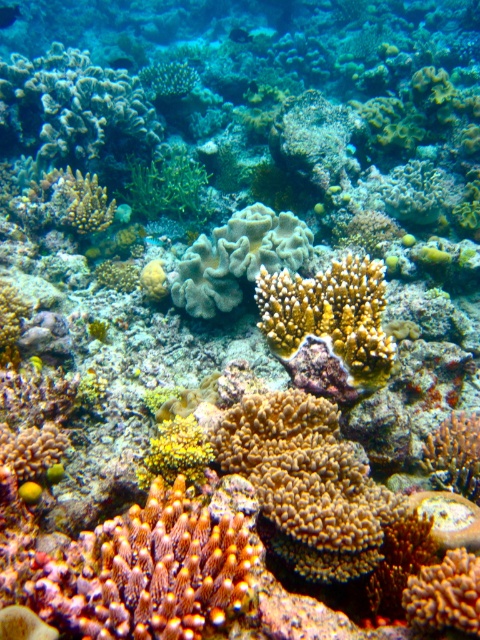
Question: Which point is closer to the camera taking this photo?

Choices:
 (A) (117, 544)
 (B) (340, 328)
 (C) (288, 253)

Answer: (A)

Question: Considering the relative positions of brown textured coral at center and smooth gray coral at center in the image provided, where is brown textured coral at center located with respect to smooth gray coral at center?

Choices:
 (A) above
 (B) below

Answer: (B)

Question: Is yellow coral at center smaller than translucent blue fish at upper left?

Choices:
 (A) yes
 (B) no

Answer: (B)

Question: Which is nearer to the brown textured coral at center?

Choices:
 (A) yellow coral at center
 (B) orange coral at center
 (C) smooth gray coral at center

Answer: (B)

Question: Which object is closer to the camera taking this photo?

Choices:
 (A) translucent blue fish at upper left
 (B) brown textured coral at center
 (C) smooth gray coral at center

Answer: (B)

Question: From the image, what is the correct spatial relationship of orange coral at center in relation to translucent blue fish at upper left?

Choices:
 (A) above
 (B) below

Answer: (B)